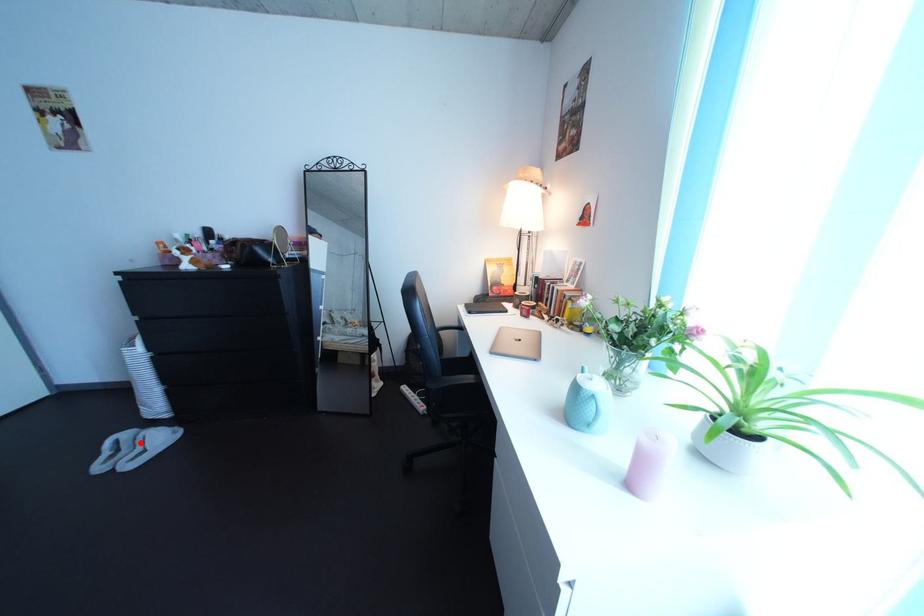
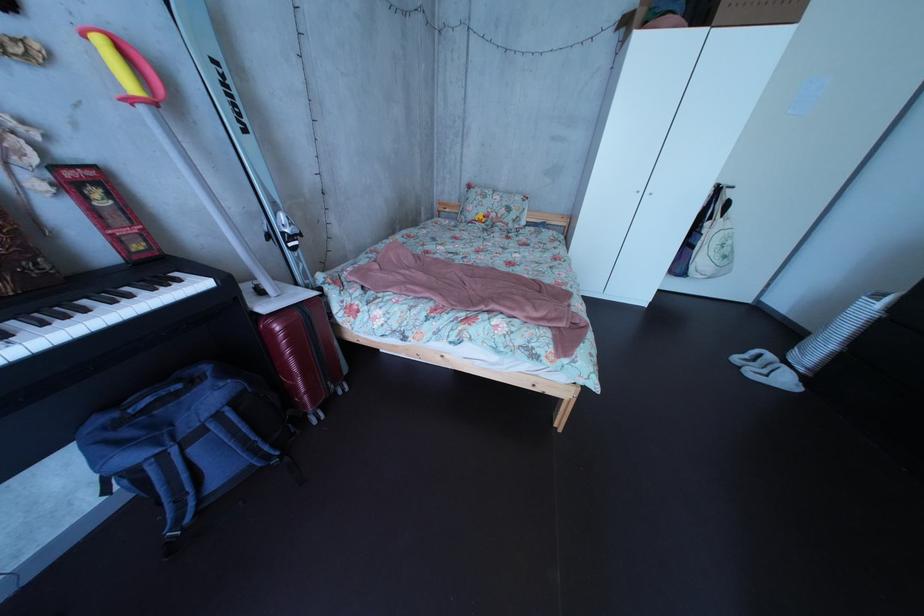
The point at the highlighted location is marked in the first image. Where is the corresponding point in the second image?

(784, 363)